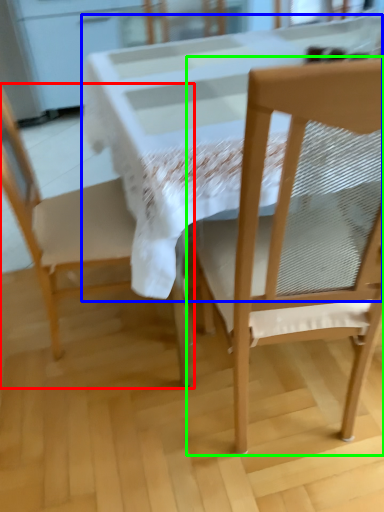
Question: Which object is positioned closest to chair (highlighted by a red box)? Select from round table (highlighted by a blue box) and chair (highlighted by a green box).

Choices:
 (A) round table
 (B) chair

Answer: (A)